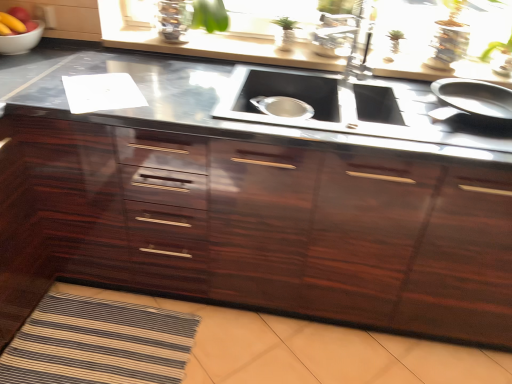
Locate an element on the screen. The width and height of the screenshot is (512, 384). vacant point above glossy wood cabinetry at center (from a real-world perspective) is located at coordinates (236, 98).